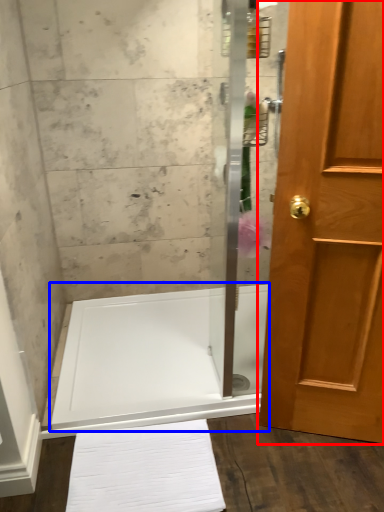
Question: Which point is further to the camera, door (highlighted by a red box) or bath (highlighted by a blue box)?

Choices:
 (A) door
 (B) bath

Answer: (B)